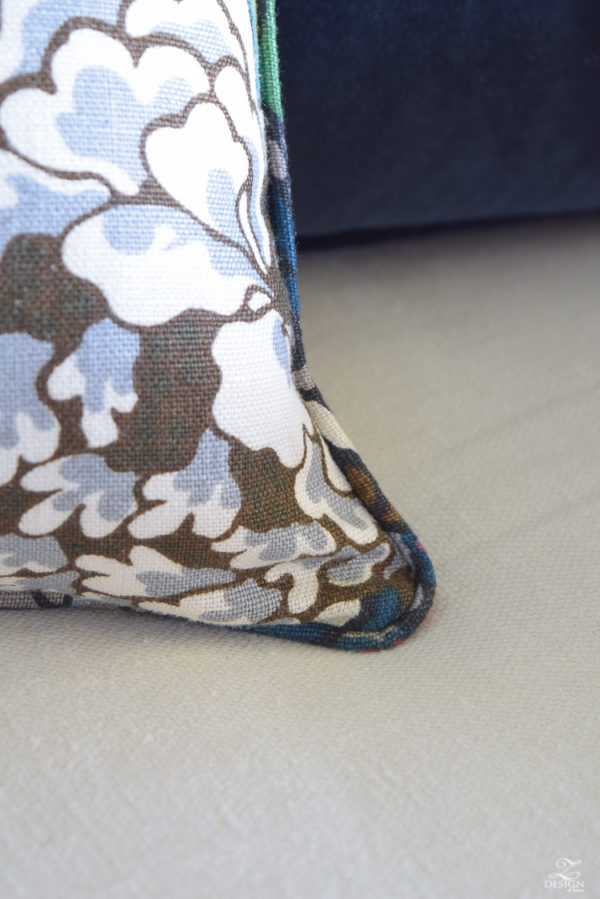
Locate an element on the screen. The width and height of the screenshot is (600, 899). pillow's shadow is located at coordinates (95, 629).